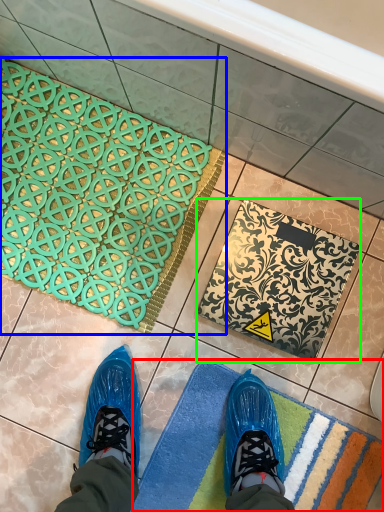
Question: Which is farther away from bath mat (highlighted by a red box)? bath mat (highlighted by a blue box) or bath mat (highlighted by a green box)?

Choices:
 (A) bath mat
 (B) bath mat

Answer: (A)